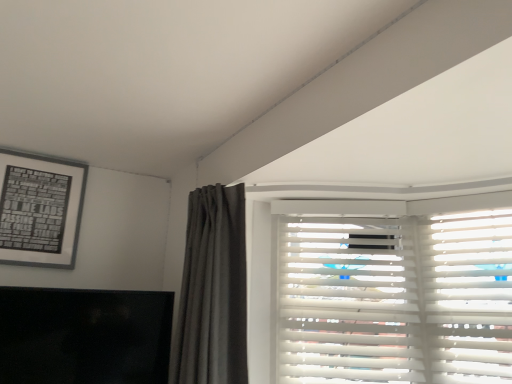
Question: Should I look upward or downward to see black matte picture frame at upper left?

Choices:
 (A) up
 (B) down

Answer: (B)

Question: Considering the relative sizes of black matte picture frame at upper left and black matte tv at lower left in the image provided, is black matte picture frame at upper left wider than black matte tv at lower left?

Choices:
 (A) no
 (B) yes

Answer: (A)

Question: From the image's perspective, is black matte picture frame at upper left beneath black matte tv at lower left?

Choices:
 (A) yes
 (B) no

Answer: (B)

Question: Is black matte picture frame at upper left taller than black matte tv at lower left?

Choices:
 (A) yes
 (B) no

Answer: (A)

Question: Is black matte tv at lower left inside black matte picture frame at upper left?

Choices:
 (A) yes
 (B) no

Answer: (B)

Question: Is black matte picture frame at upper left oriented away from black matte tv at lower left?

Choices:
 (A) yes
 (B) no

Answer: (B)

Question: Could you tell me if black matte picture frame at upper left is turned towards black matte tv at lower left?

Choices:
 (A) yes
 (B) no

Answer: (B)

Question: From the image's perspective, is black matte tv at lower left below black matte picture frame at upper left?

Choices:
 (A) no
 (B) yes

Answer: (B)

Question: Can you confirm if black matte tv at lower left is positioned to the left of black matte picture frame at upper left?

Choices:
 (A) yes
 (B) no

Answer: (B)

Question: Does black matte tv at lower left have a greater height compared to black matte picture frame at upper left?

Choices:
 (A) no
 (B) yes

Answer: (A)

Question: Is the depth of black matte tv at lower left less than that of black matte picture frame at upper left?

Choices:
 (A) no
 (B) yes

Answer: (B)

Question: From a real-world perspective, does black matte tv at lower left stand above black matte picture frame at upper left?

Choices:
 (A) no
 (B) yes

Answer: (A)

Question: Is black matte tv at lower left to the right of black matte picture frame at upper left from the viewer's perspective?

Choices:
 (A) no
 (B) yes

Answer: (B)

Question: Is the depth of white wood blinds at upper right greater than that of black matte tv at lower left?

Choices:
 (A) yes
 (B) no

Answer: (A)